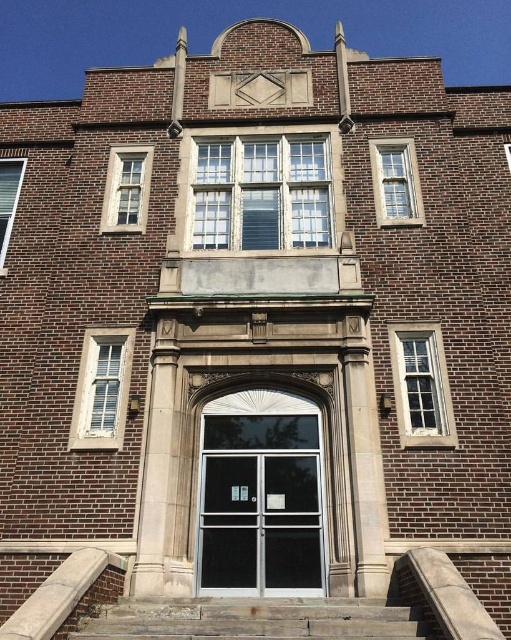
Does rusty metal stairs at lower center have a greater height compared to clear glass window at right?

In fact, rusty metal stairs at lower center may be shorter than clear glass window at right.

Can you confirm if rusty metal stairs at lower center is smaller than clear glass window at right?

Correct, rusty metal stairs at lower center occupies less space than clear glass window at right.

Which is behind, point (113, 625) or point (391, 364)?

The point (391, 364) is behind.

Locate an element on the screen. rusty metal stairs at lower center is located at coordinates (254, 620).

Who is shorter, clear glass windows at center or rusty metal stairs at lower center?

With less height is rusty metal stairs at lower center.

Can you confirm if clear glass windows at center is wider than rusty metal stairs at lower center?

Yes.

Between point (256, 172) and point (370, 632), which one is positioned in front?

Positioned in front is point (370, 632).

The width and height of the screenshot is (511, 640). Find the location of `clear glass windows at center`. clear glass windows at center is located at coordinates (262, 193).

Looking at this image, who is higher up, clear glass window at right or matte glass window at left?

matte glass window at left

Is clear glass window at right smaller than matte glass window at left?

Yes, clear glass window at right is smaller than matte glass window at left.

Find the location of a particular element. The width and height of the screenshot is (511, 640). clear glass window at right is located at coordinates (421, 385).